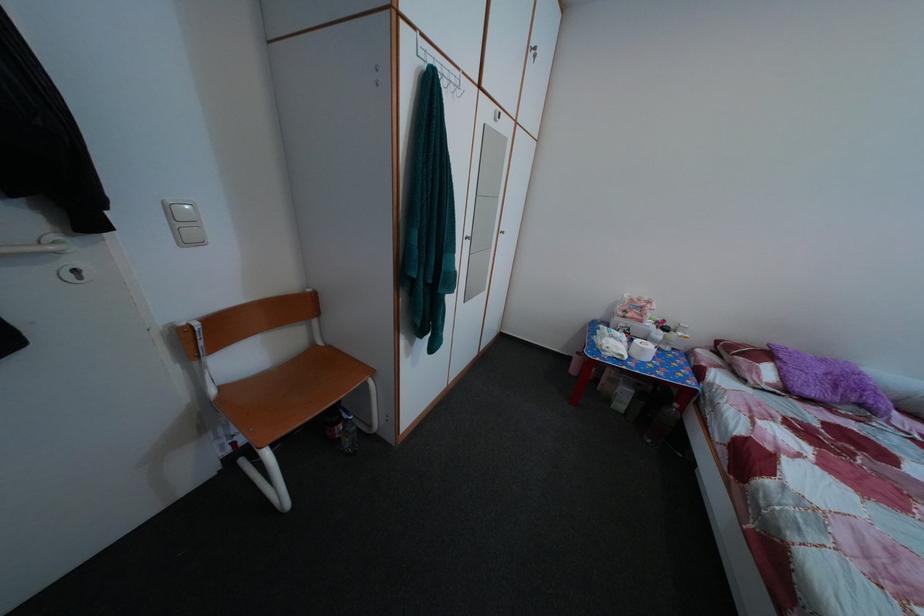
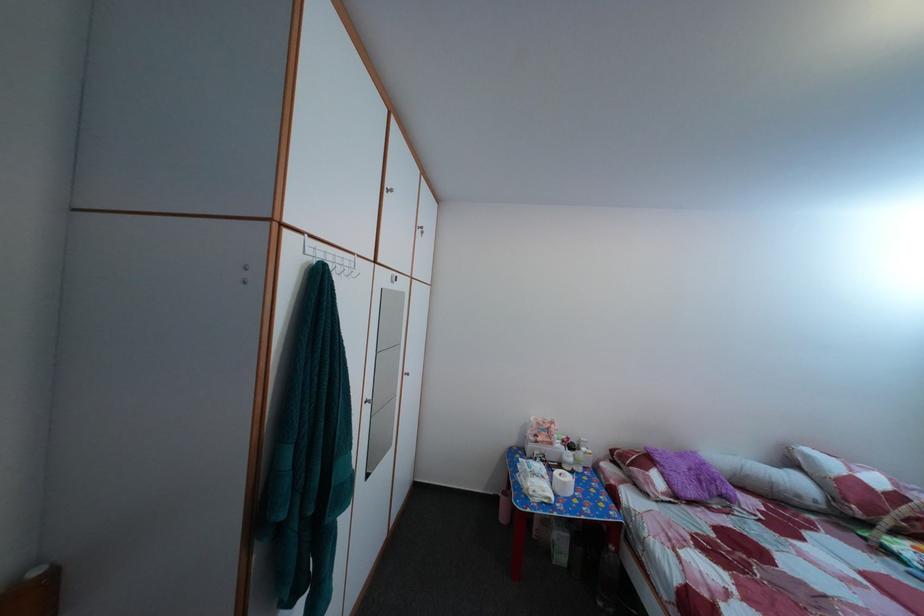
Locate, in the second image, the point that corresponds to point 624,358 in the first image.

(551, 500)